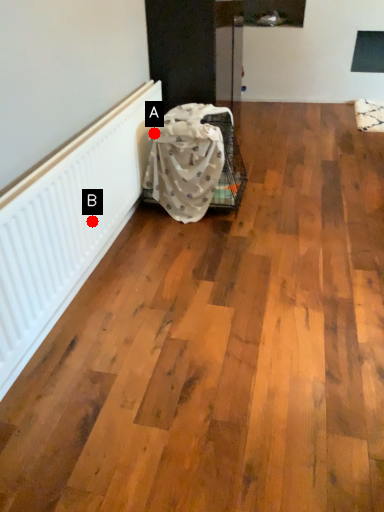
Question: Two points are circled on the image, labeled by A and B beside each circle. Which point is farther to the camera?

Choices:
 (A) A is further
 (B) B is further

Answer: (A)